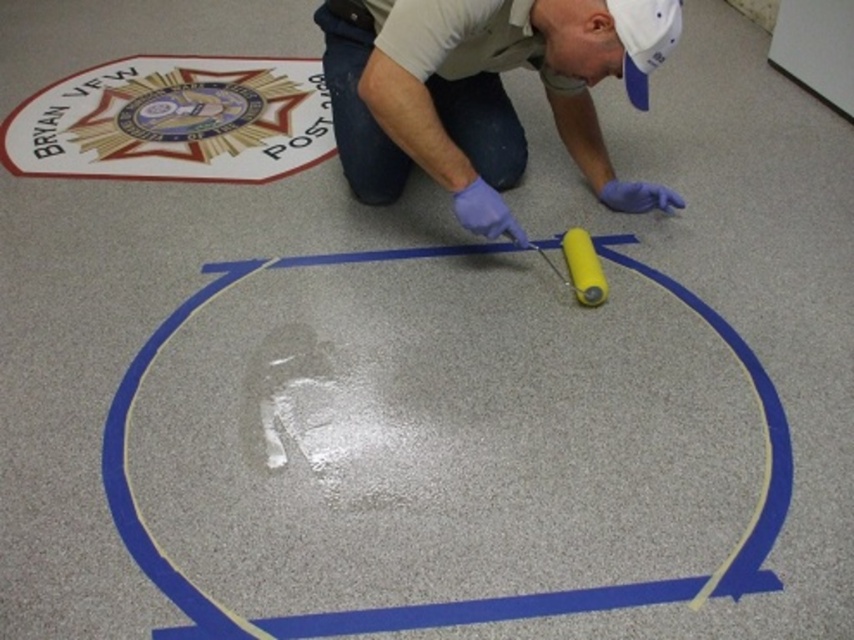
Is point (568, 19) positioned behind point (670, 579)?

Yes.

Does purple-latex-gloved-man at center have a larger size compared to blue glossy tape at center?

No, purple-latex-gloved-man at center is not bigger than blue glossy tape at center.

Locate an element on the screen. The height and width of the screenshot is (640, 854). purple-latex-gloved-man at center is located at coordinates (471, 97).